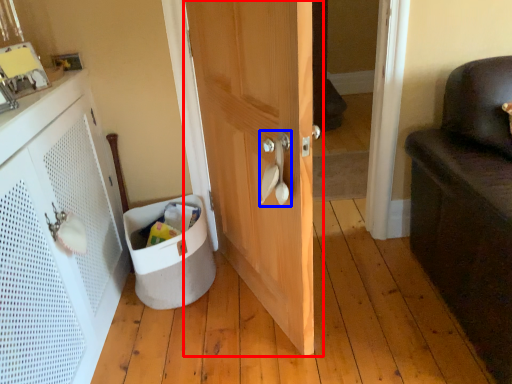
Question: Which object is further to the camera taking this photo, door (highlighted by a red box) or door handle (highlighted by a blue box)?

Choices:
 (A) door
 (B) door handle

Answer: (B)